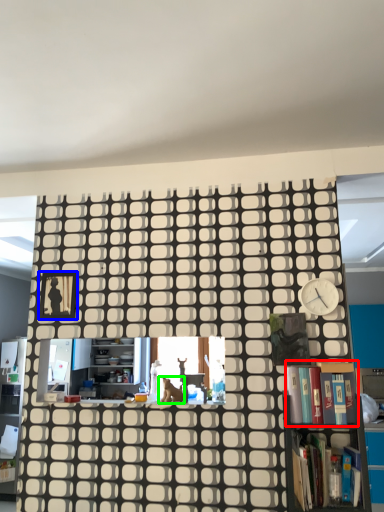
Question: Which is nearer to the book (highlighted by a red box)? picture frame (highlighted by a blue box) or animal (highlighted by a green box).

Choices:
 (A) picture frame
 (B) animal

Answer: (B)